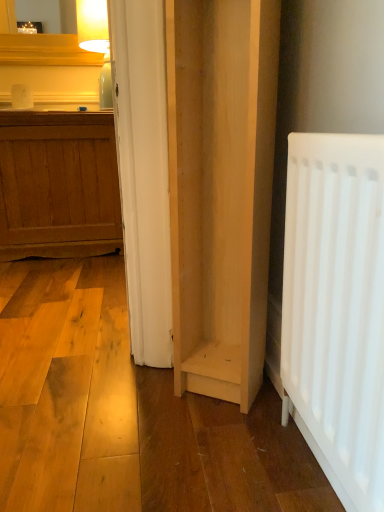
What is the approximate width of light wood cupboard at center?

light wood cupboard at center is 7.26 inches wide.

At what (x,y) coordinates should I click in order to perform the action: click on light wood cupboard at center. Please return your answer as a coordinate pair (x, y). Looking at the image, I should click on (220, 189).

Describe the element at coordinates (220, 189) in the screenshot. I see `light wood cupboard at center` at that location.

Locate an element on the screen. This screenshot has width=384, height=512. light wood cupboard at center is located at coordinates (220, 189).